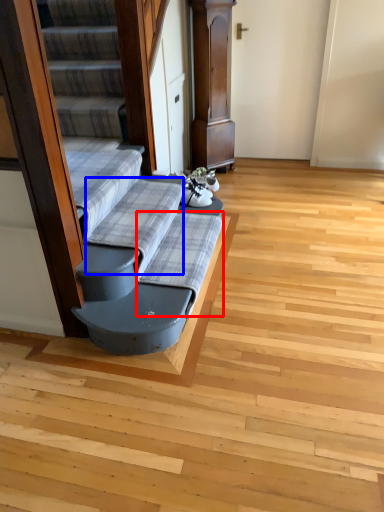
Question: Which object is closer to the camera taking this photo, sheet (highlighted by a red box) or sheet (highlighted by a blue box)?

Choices:
 (A) sheet
 (B) sheet

Answer: (B)